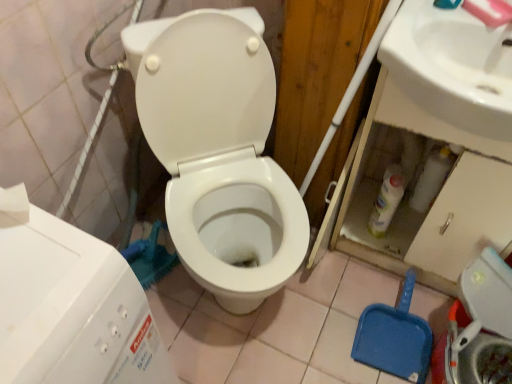
Question: From a real-world perspective, is white glossy toilet at center under white glossy sink at upper right?

Choices:
 (A) yes
 (B) no

Answer: (A)

Question: From a real-world perspective, is white glossy toilet at center located higher than white glossy sink at upper right?

Choices:
 (A) yes
 (B) no

Answer: (B)

Question: Would you say white glossy sink at upper right is part of white glossy toilet at center's contents?

Choices:
 (A) no
 (B) yes

Answer: (A)

Question: From the image's perspective, would you say white glossy toilet at center is positioned over white glossy sink at upper right?

Choices:
 (A) yes
 (B) no

Answer: (B)

Question: Can you confirm if white glossy toilet at center is taller than white glossy sink at upper right?

Choices:
 (A) yes
 (B) no

Answer: (A)

Question: Relative to white glossy sink at upper right, is white glossy toilet at center in front or behind?

Choices:
 (A) front
 (B) behind

Answer: (A)

Question: Considering the relative positions of white glossy toilet at center and white glossy sink at upper right in the image provided, is white glossy toilet at center to the left or to the right of white glossy sink at upper right?

Choices:
 (A) right
 (B) left

Answer: (B)

Question: Is white glossy toilet at center bigger or smaller than white glossy sink at upper right?

Choices:
 (A) big
 (B) small

Answer: (A)

Question: From a real-world perspective, is white glossy toilet at center physically located above or below white glossy sink at upper right?

Choices:
 (A) above
 (B) below

Answer: (B)

Question: Looking at their shapes, would you say white glossy toilet at center is wider or thinner than white plastic water tank at lower left?

Choices:
 (A) thin
 (B) wide

Answer: (B)

Question: Does point coord(217,190) appear closer or farther from the camera than point coord(22,230)?

Choices:
 (A) farther
 (B) closer

Answer: (A)

Question: Relative to white plastic water tank at lower left, is white glossy toilet at center in front or behind?

Choices:
 (A) behind
 (B) front

Answer: (A)

Question: From a real-world perspective, relative to white plastic water tank at lower left, is white glossy toilet at center vertically above or below?

Choices:
 (A) below
 (B) above

Answer: (A)

Question: From a real-world perspective, is white glossy sink at upper right physically located above or below white glossy toilet at center?

Choices:
 (A) below
 (B) above

Answer: (B)

Question: Is white glossy sink at upper right inside the boundaries of white glossy toilet at center, or outside?

Choices:
 (A) outside
 (B) inside

Answer: (A)